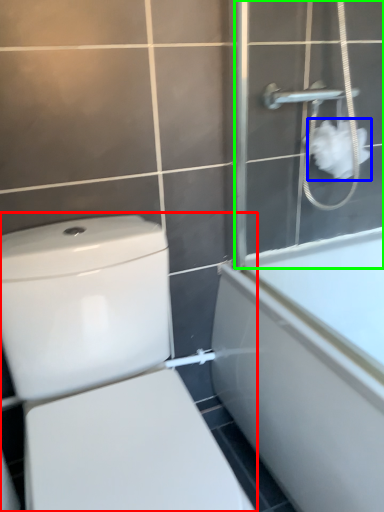
Question: Estimate the real-world distances between objects in this image. Which object is closer to toilet (highlighted by a red box), toilet paper (highlighted by a blue box) or screen door (highlighted by a green box)?

Choices:
 (A) toilet paper
 (B) screen door

Answer: (B)